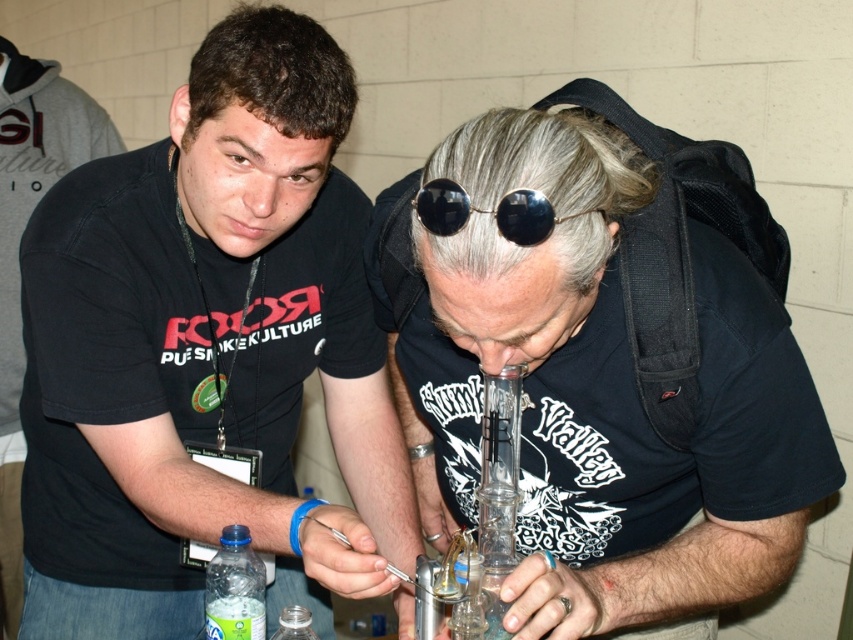
You are a photographer trying to capture a closeup of the clear plastic bottle at lower left without the black reflective sunglasses at center appearing in the shot. Given their current positions, is it possible to frame the photo so that the bottle is visible but the sunglasses are not?

The clear plastic bottle at lower left and black reflective sunglasses at center are 17.69 inches apart. Since the distance between them is significant, it should be possible to frame the photo so that the bottle is visible while excluding the sunglasses by adjusting the camera angle or zoom.

You are a photographer at this event and need to capture a closeup of the clear plastic bottle at lower left without the black reflective sunglasses at center appearing in the frame. Is this possible given their positions?

The clear plastic bottle at lower left is taller than the black reflective sunglasses at center, so it may be possible to angle the camera to focus on the bottle while avoiding the sunglasses, as the bottle is larger in height.